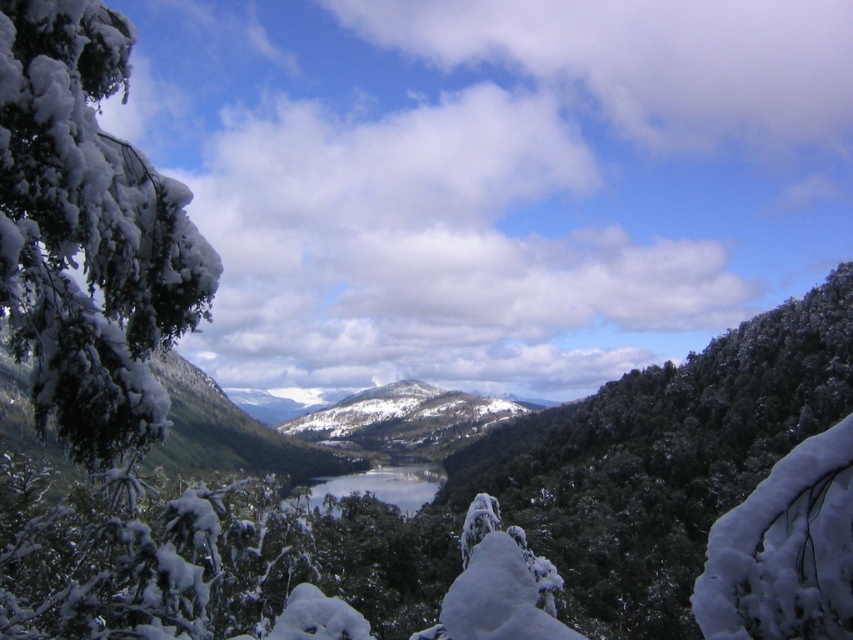
The height and width of the screenshot is (640, 853). What do you see at coordinates (88, 234) in the screenshot?
I see `white snow-covered branch at left` at bounding box center [88, 234].

Is white snow-covered branch at left shorter than white snow-covered mountain at center?

Yes, white snow-covered branch at left is shorter than white snow-covered mountain at center.

Is point (90, 300) more distant than point (311, 413)?

No, it is in front of (311, 413).

The height and width of the screenshot is (640, 853). Find the location of `white snow-covered branch at left`. white snow-covered branch at left is located at coordinates (88, 234).

Can you confirm if white snow-covered mountain at center is positioned above clear blue water at center?

Actually, white snow-covered mountain at center is below clear blue water at center.

I want to click on white snow-covered mountain at center, so click(x=405, y=417).

Who is higher up, white snow-covered branch at left or clear blue water at center?

white snow-covered branch at left is higher up.

Is white snow-covered branch at left above clear blue water at center?

Correct, white snow-covered branch at left is located above clear blue water at center.

Which is in front, point (195, 262) or point (404, 499)?

Point (195, 262) is more forward.

This screenshot has width=853, height=640. I want to click on white snow-covered branch at left, so click(88, 234).